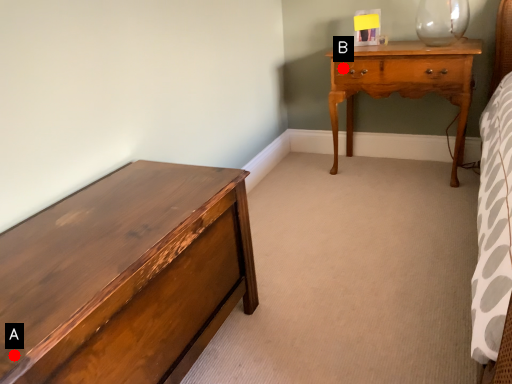
Question: Two points are circled on the image, labeled by A and B beside each circle. Which point is further to the camera?

Choices:
 (A) A is further
 (B) B is further

Answer: (B)